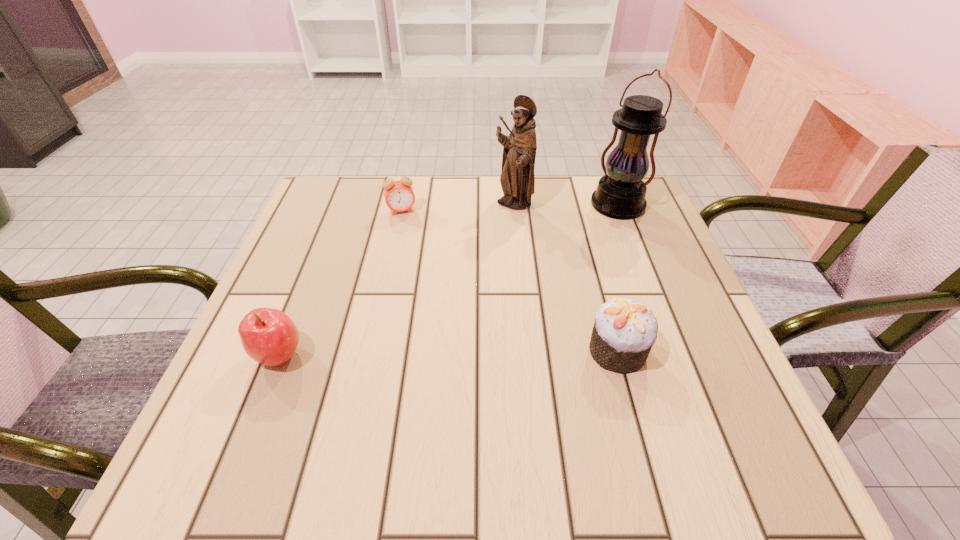
Identify a few spots in the free region located above the lantern, indicating its light source. Please provide its 2D coordinates. Your answer should be formatted as a tuple, i.e. [(x, y)], where the tuple contains the x and y coordinates of a point satisfying the conditions above.

[(585, 239)]

Find the location of a particular element. free space located on the face of the fourth object from right to left is located at coordinates (423, 283).

Locate an element on the screen. The image size is (960, 540). free space located 0.270m on the face of the fourth object from right to left is located at coordinates (425, 289).

The image size is (960, 540). Identify the location of free location located 0.370m on the face of the fourth object from right to left. (435, 325).

The image size is (960, 540). In order to click on vacant space located 0.220m on the front-facing side of the third object from right to left in this screenshot , I will do `click(484, 275)`.

At what (x,y) coordinates should I click in order to perform the action: click on free space located 0.120m on the front-facing side of the third object from right to left. Please return your answer as a coordinate pair (x, y). Looking at the image, I should click on (496, 247).

Locate an element on the screen. This screenshot has height=540, width=960. free space located 0.300m on the front-facing side of the third object from right to left is located at coordinates (472, 300).

In order to click on lantern that is at the far edge in this screenshot , I will do `click(620, 194)`.

Locate an element on the screen. This screenshot has width=960, height=540. alarm clock that is positioned at the far edge is located at coordinates (399, 196).

The image size is (960, 540). I want to click on figurine at the far edge, so click(517, 179).